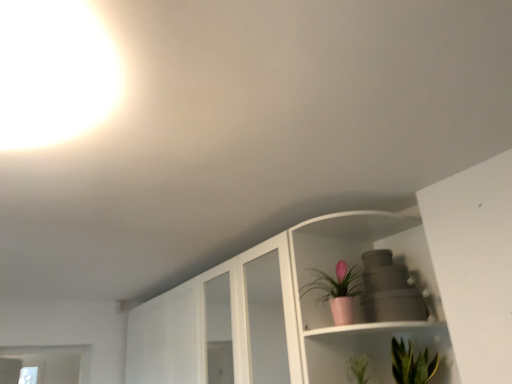
This screenshot has height=384, width=512. What do you see at coordinates (337, 291) in the screenshot?
I see `pink matte pot at upper center, the 1th houseplant positioned from the top` at bounding box center [337, 291].

Identify the location of pink matte pot at upper center, the second houseplant from the bottom. Image resolution: width=512 pixels, height=384 pixels. (337, 291).

Measure the distance between point [399,355] and camera.

6.48 feet.

At what (x,y) coordinates should I click in order to perform the action: click on green leafy plant at lower right, marked as the 1th houseplant in a right-to-left arrangement. Please return your answer as a coordinate pair (x, y). Looking at the image, I should click on (411, 364).

Image resolution: width=512 pixels, height=384 pixels. What do you see at coordinates (411, 364) in the screenshot? I see `green leafy plant at lower right, marked as the 1th houseplant in a right-to-left arrangement` at bounding box center [411, 364].

This screenshot has height=384, width=512. I want to click on pink matte pot at upper center, the second houseplant from the bottom, so click(x=337, y=291).

Is pink matte pot at upper center, the second houseplant from the bottom, to the left or to the right of green leafy plant at lower right, which is the 1th houseplant in bottom-to-top order, in the image?

From the image, it's evident that pink matte pot at upper center, the second houseplant from the bottom, is to the left of green leafy plant at lower right, which is the 1th houseplant in bottom-to-top order.

Between pink matte pot at upper center, which is the first houseplant in left-to-right order, and green leafy plant at lower right, which is the second houseplant in top-to-bottom order, which one is positioned in front?

green leafy plant at lower right, which is the second houseplant in top-to-bottom order, is in front.

Which is closer, (351,297) or (411,344)?

The point (351,297) is closer to the camera.

From the image's perspective, which one is positioned lower, pink matte pot at upper center, the second houseplant from the bottom, or green leafy plant at lower right, marked as the 1th houseplant in a right-to-left arrangement?

green leafy plant at lower right, marked as the 1th houseplant in a right-to-left arrangement, is shown below in the image.

From a real-world perspective, is pink matte pot at upper center, which is the first houseplant in left-to-right order, physically above green leafy plant at lower right, the 2th houseplant positioned from the left?

Yes.

Can you confirm if pink matte pot at upper center, the second houseplant from the bottom, is wider than green leafy plant at lower right, which is the second houseplant in top-to-bottom order?

No.

Considering the sizes of pink matte pot at upper center, which is the second houseplant from right to left, and green leafy plant at lower right, which is the second houseplant in top-to-bottom order, in the image, is pink matte pot at upper center, which is the second houseplant from right to left, taller or shorter than green leafy plant at lower right, which is the second houseplant in top-to-bottom order,?

Considering their sizes, pink matte pot at upper center, which is the second houseplant from right to left, has more height than green leafy plant at lower right, which is the second houseplant in top-to-bottom order.

Which of these two, pink matte pot at upper center, the second houseplant from the bottom, or green leafy plant at lower right, the 2th houseplant positioned from the left, is smaller?

pink matte pot at upper center, the second houseplant from the bottom, is smaller.

Is green leafy plant at lower right, which is the second houseplant in top-to-bottom order, surrounded by pink matte pot at upper center, the second houseplant from the bottom?

Definitely not — green leafy plant at lower right, which is the second houseplant in top-to-bottom order, is not inside pink matte pot at upper center, the second houseplant from the bottom.

Can you see pink matte pot at upper center, the 1th houseplant positioned from the top, touching green leafy plant at lower right, which is the second houseplant in top-to-bottom order?

No, pink matte pot at upper center, the 1th houseplant positioned from the top, is not with green leafy plant at lower right, which is the second houseplant in top-to-bottom order.

Is pink matte pot at upper center, which is the second houseplant from right to left, facing away from green leafy plant at lower right, which is the 1th houseplant in bottom-to-top order?

That's not correct — pink matte pot at upper center, which is the second houseplant from right to left, is not looking away from green leafy plant at lower right, which is the 1th houseplant in bottom-to-top order.

How different are the orientations of pink matte pot at upper center, which is the first houseplant in left-to-right order, and green leafy plant at lower right, which is the 1th houseplant in bottom-to-top order, in degrees?

pink matte pot at upper center, which is the first houseplant in left-to-right order, and green leafy plant at lower right, which is the 1th houseplant in bottom-to-top order, are facing 11.9 degrees away from each other.

At what (x,y) coordinates should I click in order to perform the action: click on houseplant that appears on the left of green leafy plant at lower right, which is the second houseplant in top-to-bottom order. Please return your answer as a coordinate pair (x, y). Looking at the image, I should click on (337, 291).

Considering the relative positions of green leafy plant at lower right, the 2th houseplant positioned from the left, and pink matte pot at upper center, which is the first houseplant in left-to-right order, in the image provided, is green leafy plant at lower right, the 2th houseplant positioned from the left, to the left or to the right of pink matte pot at upper center, which is the first houseplant in left-to-right order,?

green leafy plant at lower right, the 2th houseplant positioned from the left, is to the right of pink matte pot at upper center, which is the first houseplant in left-to-right order.

Between green leafy plant at lower right, which is the 1th houseplant in bottom-to-top order, and pink matte pot at upper center, the second houseplant from the bottom, which one is positioned in front?

green leafy plant at lower right, which is the 1th houseplant in bottom-to-top order, is more forward.

Does point (407, 370) come in front of point (324, 295)?

Yes.

From the image's perspective, is green leafy plant at lower right, marked as the 1th houseplant in a right-to-left arrangement, located beneath pink matte pot at upper center, which is the second houseplant from right to left?

Indeed, from the image's perspective, green leafy plant at lower right, marked as the 1th houseplant in a right-to-left arrangement, is shown beneath pink matte pot at upper center, which is the second houseplant from right to left.

From a real-world perspective, between green leafy plant at lower right, which is the second houseplant in top-to-bottom order, and pink matte pot at upper center, the 1th houseplant positioned from the top, who is vertically higher?

In real-world perspective, pink matte pot at upper center, the 1th houseplant positioned from the top, is above.

Does green leafy plant at lower right, which is the second houseplant in top-to-bottom order, have a greater width compared to pink matte pot at upper center, the 1th houseplant positioned from the top?

Indeed, green leafy plant at lower right, which is the second houseplant in top-to-bottom order, has a greater width compared to pink matte pot at upper center, the 1th houseplant positioned from the top.

Is green leafy plant at lower right, marked as the 1th houseplant in a right-to-left arrangement, taller or shorter than pink matte pot at upper center, which is the second houseplant from right to left?

Considering their sizes, green leafy plant at lower right, marked as the 1th houseplant in a right-to-left arrangement, has less height than pink matte pot at upper center, which is the second houseplant from right to left.

Can you confirm if green leafy plant at lower right, which is the second houseplant in top-to-bottom order, is bigger than pink matte pot at upper center, which is the second houseplant from right to left?

Yes.

Is pink matte pot at upper center, which is the first houseplant in left-to-right order, surrounded by green leafy plant at lower right, the 2th houseplant positioned from the left?

Definitely not — pink matte pot at upper center, which is the first houseplant in left-to-right order, is not inside green leafy plant at lower right, the 2th houseplant positioned from the left.

Consider the image. Is green leafy plant at lower right, marked as the 1th houseplant in a right-to-left arrangement, beside pink matte pot at upper center, the 1th houseplant positioned from the top?

No, green leafy plant at lower right, marked as the 1th houseplant in a right-to-left arrangement, is not in contact with pink matte pot at upper center, the 1th houseplant positioned from the top.

Is green leafy plant at lower right, which is the second houseplant in top-to-bottom order, aimed at pink matte pot at upper center, which is the second houseplant from right to left?

No, green leafy plant at lower right, which is the second houseplant in top-to-bottom order, is not facing towards pink matte pot at upper center, which is the second houseplant from right to left.

What's the angular difference between green leafy plant at lower right, the 2th houseplant positioned from the left, and pink matte pot at upper center, the 1th houseplant positioned from the top,'s facing directions?

They differ by 11.9 degrees in their facing directions.

I want to click on houseplant that is in front of the pink matte pot at upper center, the 1th houseplant positioned from the top, so click(x=411, y=364).

Find the location of a particular element. houseplant that is above the green leafy plant at lower right, which is the 1th houseplant in bottom-to-top order (from the image's perspective) is located at coordinates (337, 291).

Image resolution: width=512 pixels, height=384 pixels. I want to click on houseplant that is under the pink matte pot at upper center, the 1th houseplant positioned from the top (from a real-world perspective), so [411, 364].